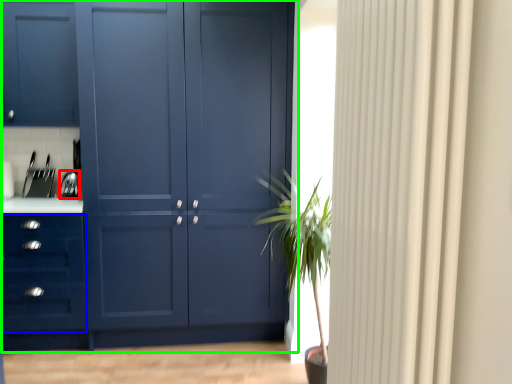
Question: Which object is the closest to the appliance (highlighted by a red box)? Choose among these: drawer (highlighted by a blue box) or cupboard (highlighted by a green box).

Choices:
 (A) drawer
 (B) cupboard

Answer: (A)